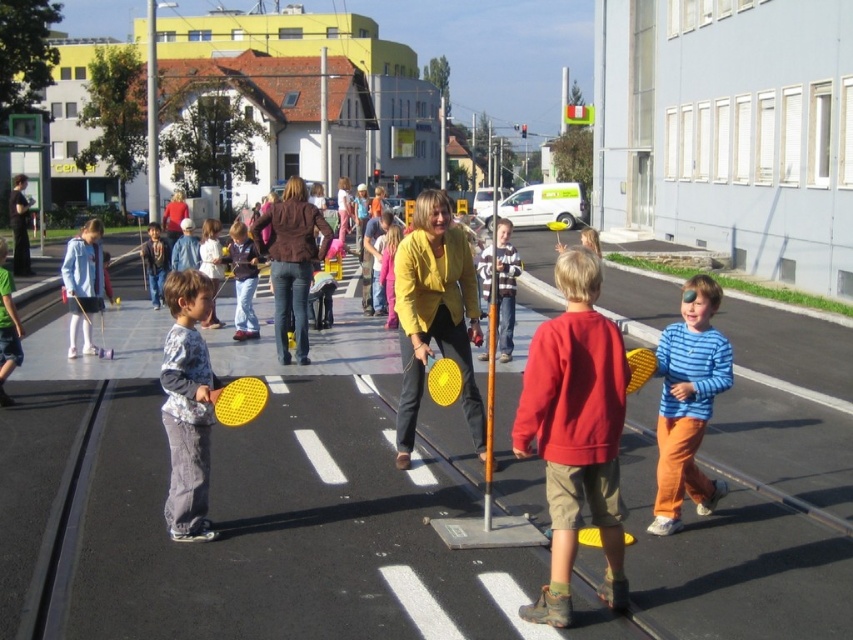
You are a participant in a street game where you need to hit a ball over a pole to score points. The game area has an orange metallic pole at center and a brushed metal pole at center. Which pole should you aim to hit the ball over to score?

The orange metallic pole at center is much taller than the brushed metal pole at center, so you should aim to hit the ball over the brushed metal pole at center to score since it is shorter and easier to clear.

You are standing at the center of the image and want to place a small flag exactly where the orange metallic pole at center is located. According to the coordinates provided, is the pole closer to the top or bottom of the image?

The orange metallic pole at center is located at coordinates point [490,358]. Since the y coordinate is 0.576, which is closer to 0.5 than to 0 or 1, it is positioned near the center vertically. Therefore, it is neither closer to the top nor the bottom of the image.